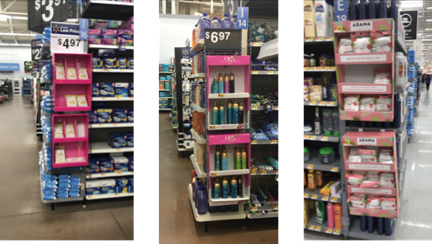
At what (x,y) coordinates should I click in order to perform the action: click on floor of end of store aisle. Please return your answer as a coordinate pair (x, y). Looking at the image, I should click on (72, 224), (216, 239), (314, 237).